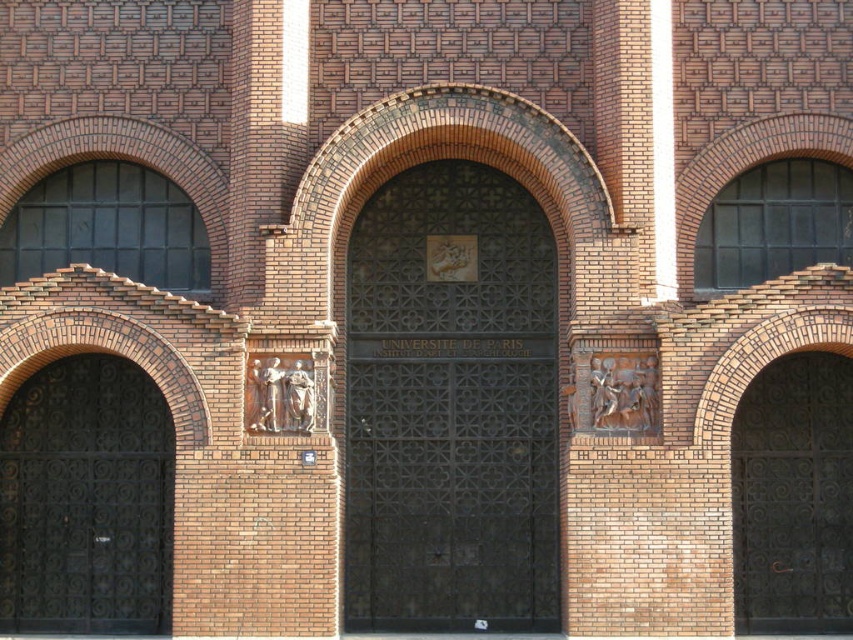
You are a delivery person with a cart that is 2 meters wide. You need to pass through the gates to deliver packages to the Institut dArchaeologie. The gates are the black wrought iron gate at left and the dark brown wrought iron gate at right. Can your cart fit through the space between them?

The distance between the black wrought iron gate at left and the dark brown wrought iron gate at right is 21.27 meters, which is significantly wider than your 2 meter wide cart. Yes, your cart can easily fit through the space between them.

You are an archaeology student visiting the Universite de Paris Institut dArchaeologie. You need to enter through one of the gates. The dark bronze gate at center and the dark brown wrought iron gate at right are both options. Which gate should you choose if you need to pass through with a large artifact box that is 1.8 meters wide?

The dark bronze gate at center is wider than the dark brown wrought iron gate at right, so you should choose the dark bronze gate at center to pass through with your large artifact box.